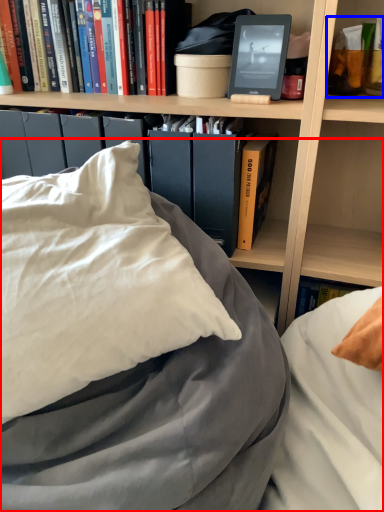
Question: Which point is further to the camera, bed (highlighted by a red box) or book (highlighted by a blue box)?

Choices:
 (A) bed
 (B) book

Answer: (B)